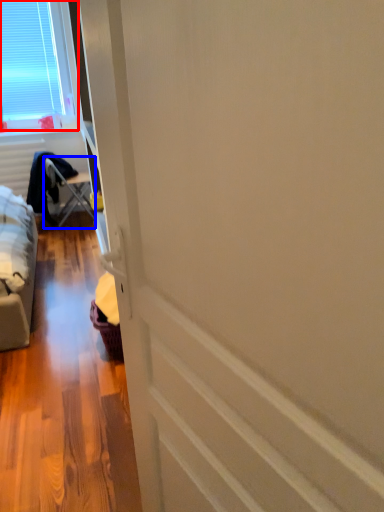
Question: Which object appears farthest to the camera in this image, window (highlighted by a red box) or furniture (highlighted by a blue box)?

Choices:
 (A) window
 (B) furniture

Answer: (B)